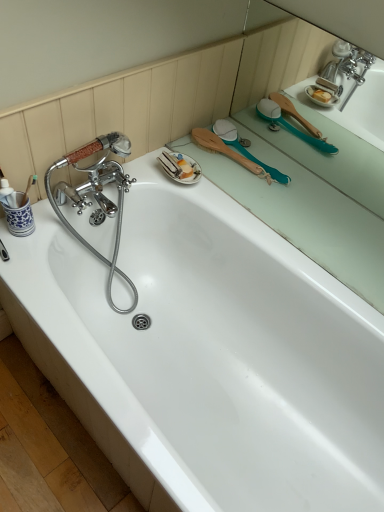
Question: Considering the relative sizes of green rubber brush at upper right, the 1th mirror from the top, and teal rubber brush at upper right, the first mirror ordered from the bottom, in the image provided, is green rubber brush at upper right, the 1th mirror from the top, wider than teal rubber brush at upper right, the first mirror ordered from the bottom,?

Choices:
 (A) yes
 (B) no

Answer: (B)

Question: Could teal rubber brush at upper right, the first mirror ordered from the bottom, be considered to be inside green rubber brush at upper right, the 1th mirror from the top?

Choices:
 (A) no
 (B) yes

Answer: (A)

Question: Is green rubber brush at upper right, the 2th mirror from the bottom, positioned with its back to teal rubber brush at upper right, the first mirror ordered from the bottom?

Choices:
 (A) yes
 (B) no

Answer: (B)

Question: From a real-world perspective, is green rubber brush at upper right, the 1th mirror from the top, over teal rubber brush at upper right, the first mirror ordered from the bottom?

Choices:
 (A) yes
 (B) no

Answer: (A)

Question: Is green rubber brush at upper right, the 1th mirror from the top, with teal rubber brush at upper right, the first mirror ordered from the bottom?

Choices:
 (A) no
 (B) yes

Answer: (B)

Question: Is white glossy bathtub at upper center bigger or smaller than green rubber brush at upper right, the 2th mirror from the bottom?

Choices:
 (A) big
 (B) small

Answer: (A)

Question: Considering the positions of white glossy bathtub at upper center and green rubber brush at upper right, the 2th mirror from the bottom, in the image, is white glossy bathtub at upper center wider or thinner than green rubber brush at upper right, the 2th mirror from the bottom,?

Choices:
 (A) wide
 (B) thin

Answer: (A)

Question: In the image, is white glossy bathtub at upper center on the left side or the right side of green rubber brush at upper right, the 1th mirror from the top?

Choices:
 (A) right
 (B) left

Answer: (B)

Question: From the image's perspective, is white glossy bathtub at upper center above or below green rubber brush at upper right, the 1th mirror from the top?

Choices:
 (A) above
 (B) below

Answer: (B)

Question: From a real-world perspective, is white glossy bathtub at upper center above or below wooden-brushed teal brush at upper right?

Choices:
 (A) below
 (B) above

Answer: (A)

Question: Is white glossy bathtub at upper center inside the boundaries of wooden-brushed teal brush at upper right, or outside?

Choices:
 (A) outside
 (B) inside

Answer: (A)

Question: Considering the positions of white glossy bathtub at upper center and wooden-brushed teal brush at upper right in the image, is white glossy bathtub at upper center taller or shorter than wooden-brushed teal brush at upper right?

Choices:
 (A) tall
 (B) short

Answer: (A)

Question: Considering the positions of point (241, 352) and point (205, 134), is point (241, 352) closer or farther from the camera than point (205, 134)?

Choices:
 (A) farther
 (B) closer

Answer: (B)

Question: Is green rubber brush at upper right, the 1th mirror from the top, inside the boundaries of teal rubber brush at upper right, the second mirror in the top-to-bottom sequence, or outside?

Choices:
 (A) outside
 (B) inside

Answer: (A)

Question: Is green rubber brush at upper right, the 2th mirror from the bottom, wider or thinner than teal rubber brush at upper right, the second mirror in the top-to-bottom sequence?

Choices:
 (A) wide
 (B) thin

Answer: (B)